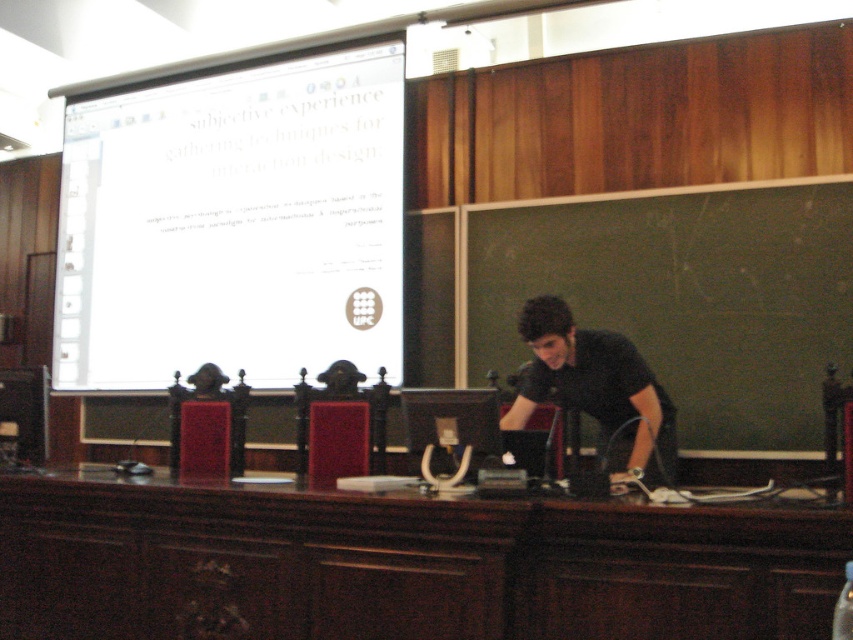
You are an attendee at a design conference and you see the green chalkboard at center and the black matte shirt at center. Which object is bigger in size?

The green chalkboard at center is larger in size compared to the black matte shirt at center.

Based on the scene described, which object occupies a more prominent position in terms of size between the white glossy projection screen at upper center and the green chalkboard at center?

The white glossy projection screen at upper center has a larger size compared to the green chalkboard at center, making it more prominent in terms of size.

You are a student in the lecture hall and want to write a note on the green chalkboard at center. Can you reach it from your current position in front of the white glossy projection screen at upper center?

The green chalkboard at center is behind the white glossy projection screen at upper center, so you cannot reach it from your current position in front of the white glossy projection screen at upper center.